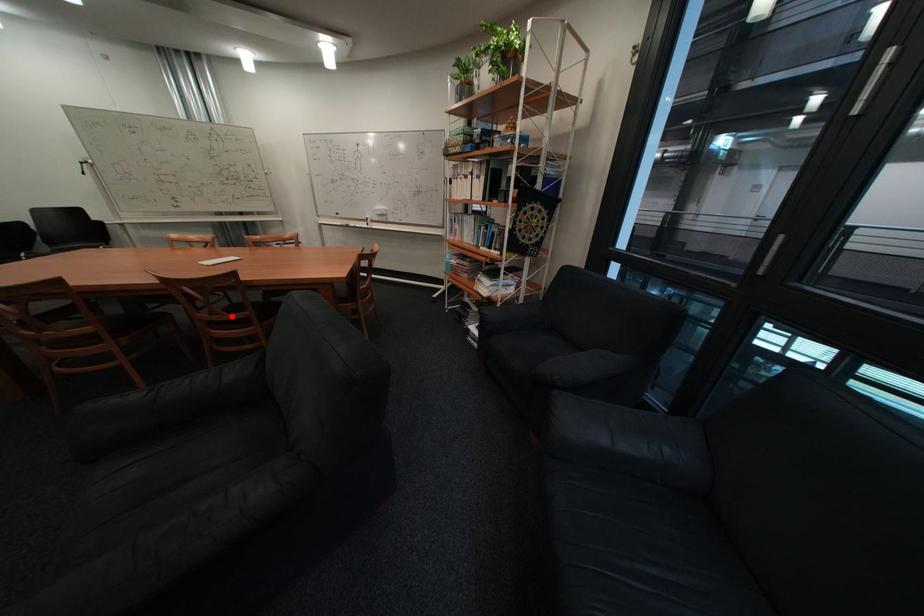
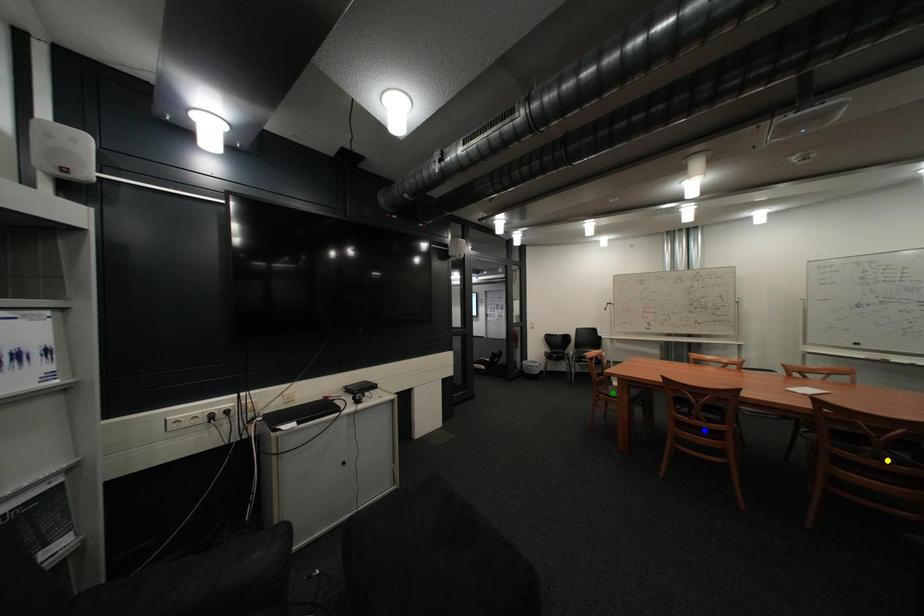
Question: I am providing you with two images of the same scene from different viewpoints. A red point is marked on the first image. You are given multiple points on the second image. In image 2, which mark is for the same physical point as the one in image 1?

Choices:
 (A) yellow point
 (B) blue point
 (C) green point

Answer: (A)